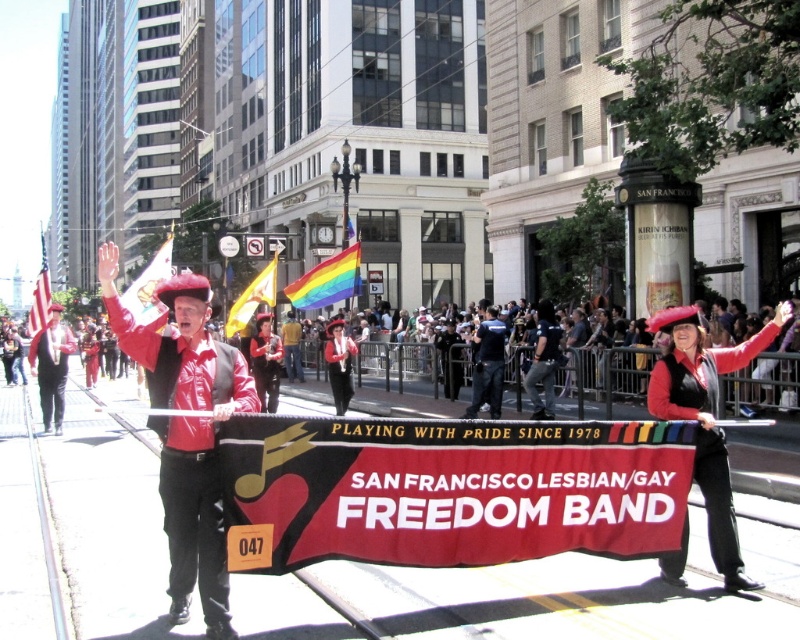
Question: Which of the following is the farthest from the observer?

Choices:
 (A) matte red hat at center
 (B) yellowmaterial/textureflag at upper center

Answer: (B)

Question: Among these objects, which one is nearest to the camera?

Choices:
 (A) matte red hat at center
 (B) shiny leather jacket at center

Answer: (B)

Question: In this image, where is matte black jacket at center located relative to shiny black vest at center?

Choices:
 (A) right
 (B) left

Answer: (A)

Question: Does shiny red leather jacket at left appear over matte black jacket at center?

Choices:
 (A) no
 (B) yes

Answer: (A)

Question: Is matte red hat at center bigger than matte black jacket at center?

Choices:
 (A) no
 (B) yes

Answer: (A)

Question: Based on their relative distances, which object is farther from the rainbow fabric flag at center?

Choices:
 (A) red fabric banner at center
 (B) shiny red hat at center

Answer: (A)